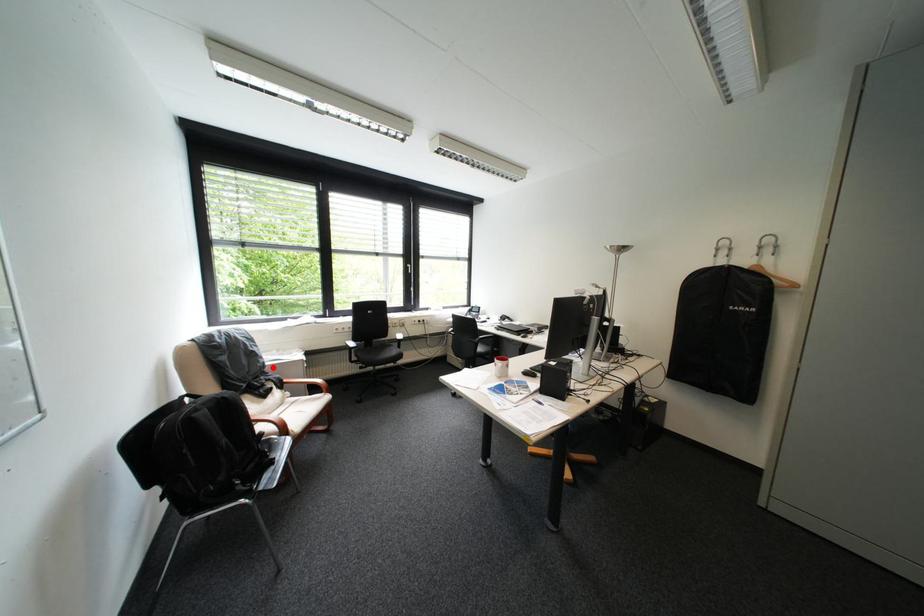
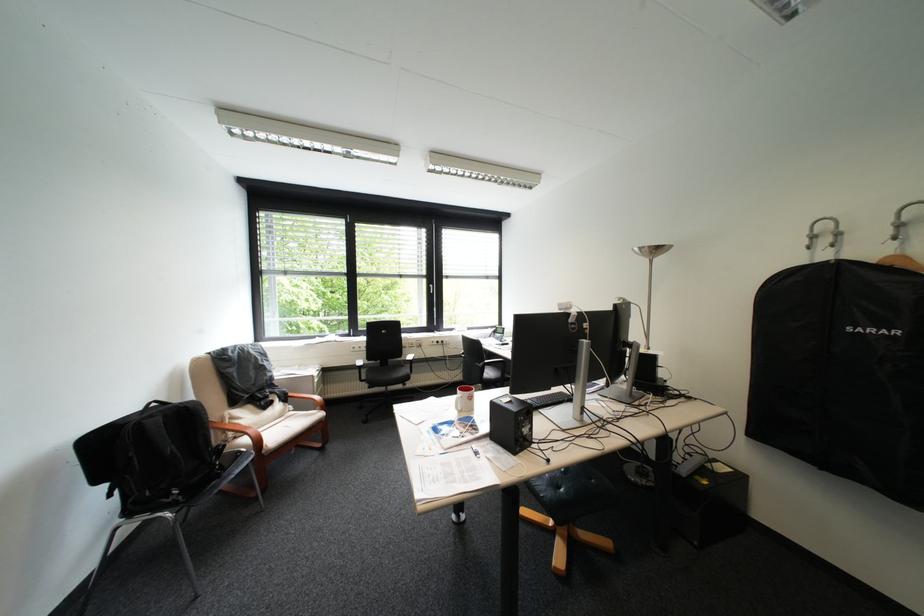
Locate, in the second image, the point that corresponds to the highlighted location in the first image.

(280, 381)